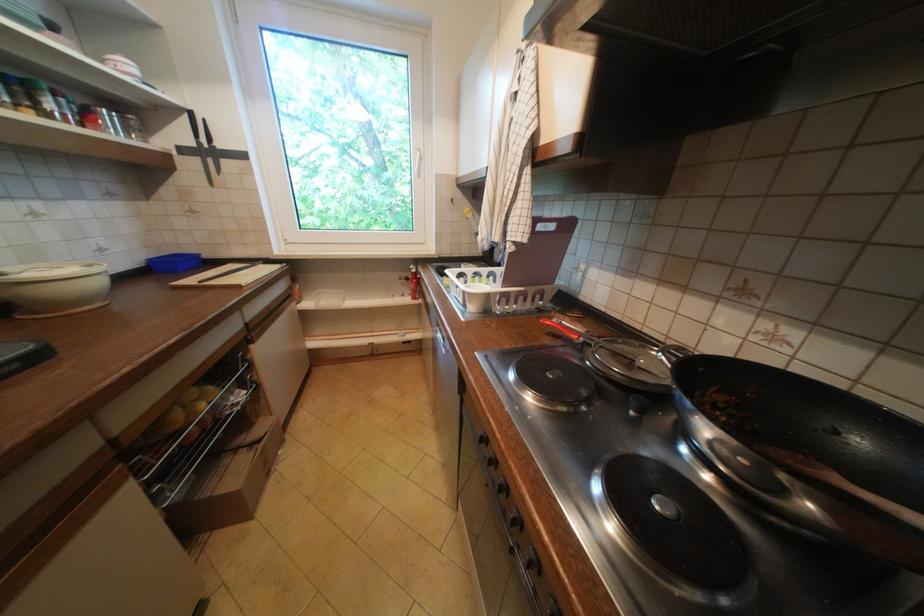
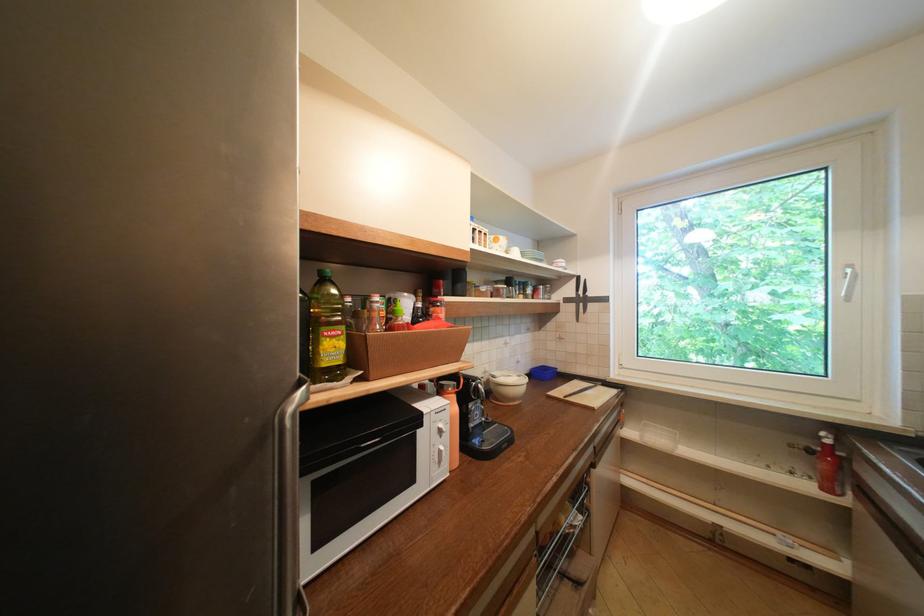
The point at (237,413) is marked in the first image. Where is the corresponding point in the second image?

(576, 532)